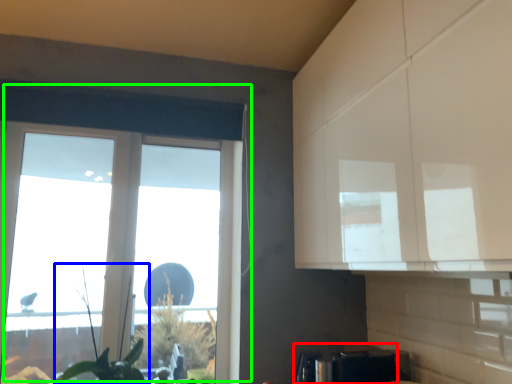
Question: Which object is positioned farthest from appliance (highlighted by a red box)? Select from plant (highlighted by a blue box) and window (highlighted by a green box).

Choices:
 (A) plant
 (B) window

Answer: (B)